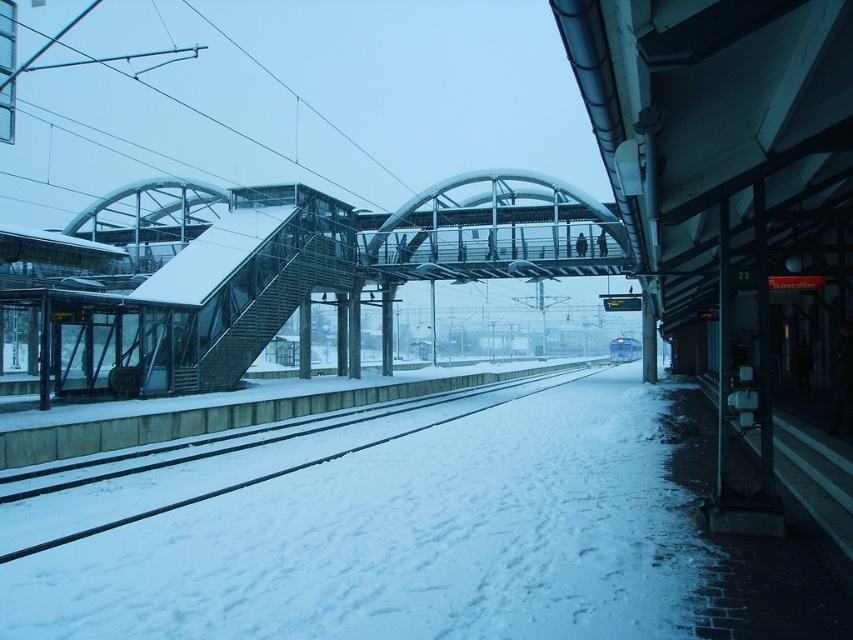
Question: Does snow-covered tracks at center have a smaller size compared to blue glossy train at center?

Choices:
 (A) no
 (B) yes

Answer: (A)

Question: Which of the following is the closest to the observer?

Choices:
 (A) snow-covered tracks at center
 (B) blue glossy train at center

Answer: (A)

Question: From the image, what is the correct spatial relationship of snow-covered tracks at center in relation to blue glossy train at center?

Choices:
 (A) right
 (B) left

Answer: (B)

Question: Which of the following is the farthest from the observer?

Choices:
 (A) (630, 342)
 (B) (86, 476)

Answer: (A)

Question: Is snow-covered tracks at center to the right of blue glossy train at center from the viewer's perspective?

Choices:
 (A) yes
 (B) no

Answer: (B)